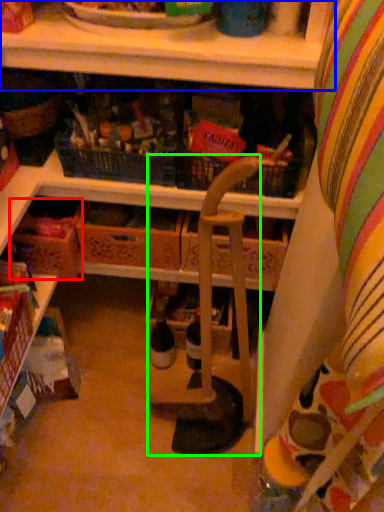
Question: Which is nearer to the drawer (highlighted by a red box)? shelf (highlighted by a blue box) or armchair (highlighted by a green box).

Choices:
 (A) shelf
 (B) armchair

Answer: (B)